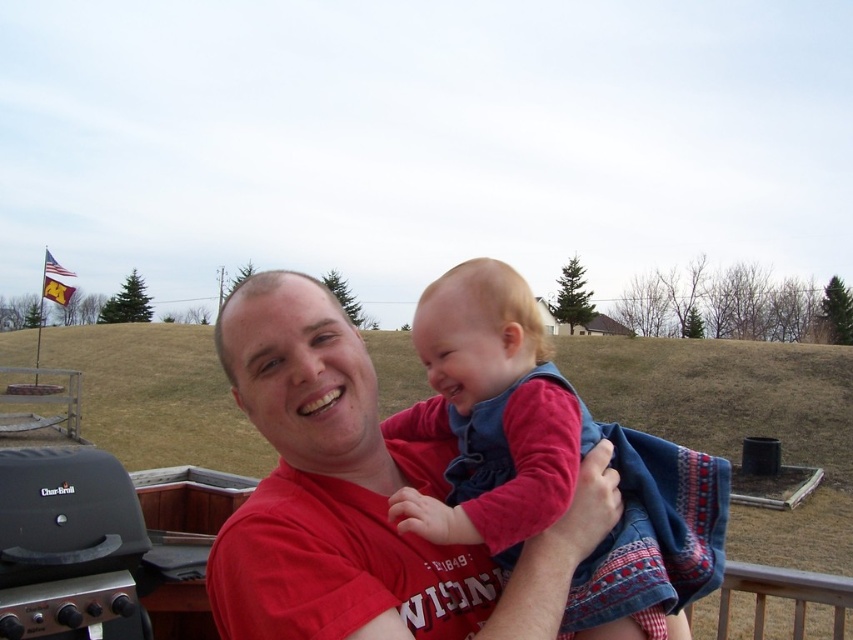
Question: Can you confirm if velvety blue dress at center is positioned below black matte grill at lower left?

Choices:
 (A) yes
 (B) no

Answer: (B)

Question: Where is velvety blue dress at center located in relation to black matte grill at lower left in the image?

Choices:
 (A) above
 (B) below

Answer: (A)

Question: Which of the following is the closest to the observer?

Choices:
 (A) (460, 509)
 (B) (111, 588)

Answer: (A)

Question: Can you confirm if velvety blue dress at center is positioned to the right of black matte grill at lower left?

Choices:
 (A) yes
 (B) no

Answer: (A)